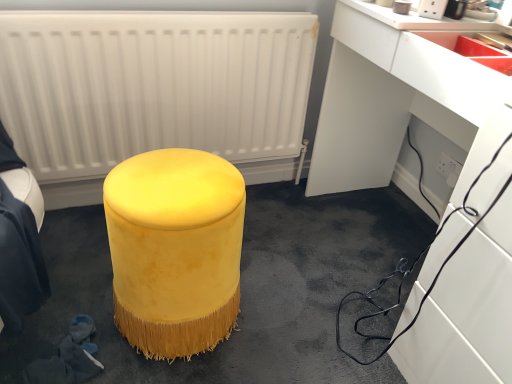
Question: Is matte red sink at upper right bigger or smaller than white plastic electric outlet at lower right?

Choices:
 (A) big
 (B) small

Answer: (A)

Question: From a real-world perspective, relative to white plastic electric outlet at lower right, is matte red sink at upper right vertically above or below?

Choices:
 (A) below
 (B) above

Answer: (B)

Question: Which object is positioned closest to the matte red sink at upper right?

Choices:
 (A) white matte radiator at upper center
 (B) velvet yellow stool at center
 (C) white plastic electric outlet at lower right
 (D) white glossy computer desk at lower right
 (E) velvet yellow ottoman at center

Answer: (D)

Question: Which is farther from the velvet yellow stool at center?

Choices:
 (A) white glossy computer desk at lower right
 (B) matte red sink at upper right
 (C) white plastic electric outlet at lower right
 (D) velvet yellow ottoman at center
 (E) white matte radiator at upper center

Answer: (B)